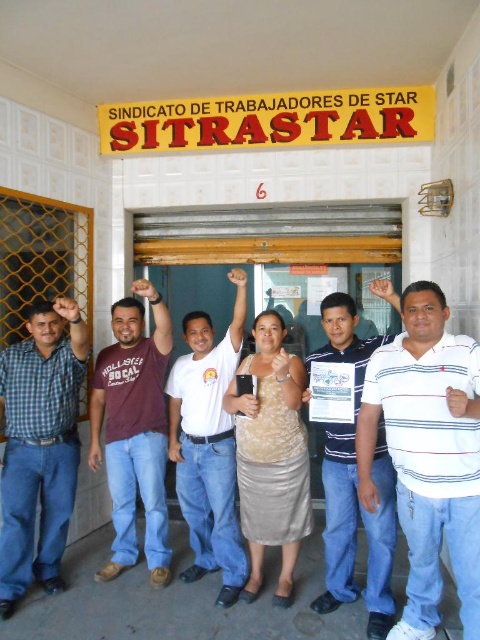
Question: Can you confirm if matte blue jeans at left is smaller than blue striped shirt at center?

Choices:
 (A) yes
 (B) no

Answer: (B)

Question: Can you confirm if white striped shirt at center is positioned below white cotton shirt at center?

Choices:
 (A) yes
 (B) no

Answer: (A)

Question: Which of the following is the closest to the observer?

Choices:
 (A) white cotton shirt at center
 (B) maroon cotton shirt at center

Answer: (A)

Question: Which object is the closest to the white striped shirt at center?

Choices:
 (A) blue striped shirt at center
 (B) maroon cotton shirt at center
 (C) white cotton shirt at center

Answer: (A)

Question: Is maroon cotton shirt at center to the right of white cotton shirt at center from the viewer's perspective?

Choices:
 (A) no
 (B) yes

Answer: (A)

Question: Which of these objects is positioned farthest from the maroon cotton shirt at center?

Choices:
 (A) white cotton shirt at center
 (B) matte blue jeans at left
 (C) blue striped shirt at center
 (D) white striped shirt at center

Answer: (D)